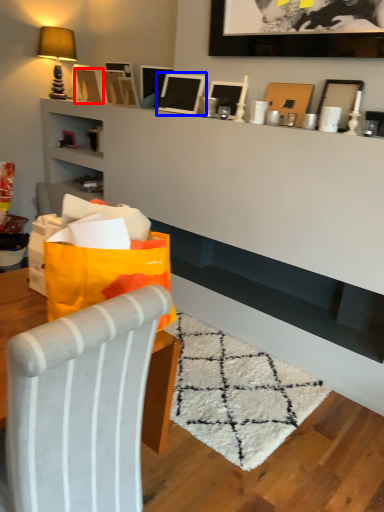
Question: Which object is closer to the camera taking this photo, picture frame (highlighted by a red box) or picture frame (highlighted by a blue box)?

Choices:
 (A) picture frame
 (B) picture frame

Answer: (B)